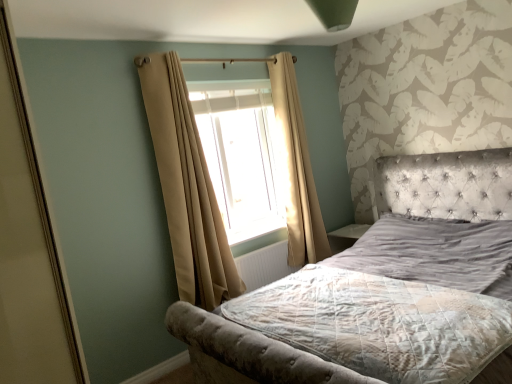
Question: Does textured gray mattress at center have a greater height compared to translucent fabric window at center?

Choices:
 (A) no
 (B) yes

Answer: (A)

Question: Considering the relative sizes of textured gray mattress at center and translucent fabric window at center in the image provided, is textured gray mattress at center bigger than translucent fabric window at center?

Choices:
 (A) no
 (B) yes

Answer: (A)

Question: Is translucent fabric window at center completely or partially inside textured gray mattress at center?

Choices:
 (A) yes
 (B) no

Answer: (B)

Question: Is the depth of textured gray mattress at center greater than that of translucent fabric window at center?

Choices:
 (A) no
 (B) yes

Answer: (A)

Question: Is textured gray mattress at center positioned in front of translucent fabric window at center?

Choices:
 (A) no
 (B) yes

Answer: (B)

Question: From their relative heights in the image, would you say translucent fabric window at center is taller or shorter than textured gray mattress at center?

Choices:
 (A) short
 (B) tall

Answer: (B)

Question: In terms of width, does translucent fabric window at center look wider or thinner when compared to textured gray mattress at center?

Choices:
 (A) wide
 (B) thin

Answer: (B)

Question: From the image's perspective, is translucent fabric window at center located above or below textured gray mattress at center?

Choices:
 (A) above
 (B) below

Answer: (A)

Question: In the image, is translucent fabric window at center positioned in front of or behind textured gray mattress at center?

Choices:
 (A) behind
 (B) front

Answer: (A)

Question: Is point click(x=280, y=311) positioned closer to the camera than point click(x=284, y=221)?

Choices:
 (A) closer
 (B) farther

Answer: (A)

Question: From their relative heights in the image, would you say textured gray mattress at center is taller or shorter than translucent fabric window at center?

Choices:
 (A) short
 (B) tall

Answer: (A)

Question: Is textured gray mattress at center to the left or to the right of translucent fabric window at center in the image?

Choices:
 (A) right
 (B) left

Answer: (A)

Question: From the image's perspective, is textured gray mattress at center positioned above or below translucent fabric window at center?

Choices:
 (A) below
 (B) above

Answer: (A)

Question: Relative to velvet grey bed at center, is white textured radiator at center in front or behind?

Choices:
 (A) behind
 (B) front

Answer: (A)

Question: Does point (263, 274) appear closer or farther from the camera than point (504, 337)?

Choices:
 (A) closer
 (B) farther

Answer: (B)